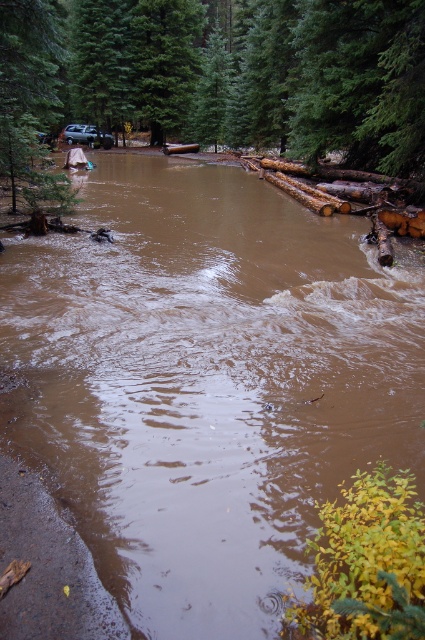
Question: Which object is the farthest from the green matte tree at upper center?

Choices:
 (A) green matte tree at upper left
 (B) metallic silver suv at upper left

Answer: (B)

Question: Is green matte tree at upper left thinner than metallic silver suv at upper left?

Choices:
 (A) no
 (B) yes

Answer: (A)

Question: Estimate the real-world distances between objects in this image. Which object is closer to the metallic silver suv at upper left?

Choices:
 (A) green matte tree at upper center
 (B) green matte tree at upper left

Answer: (A)

Question: Which object appears closest to the camera in this image?

Choices:
 (A) green matte tree at upper center
 (B) metallic silver suv at upper left

Answer: (A)

Question: From the image, what is the correct spatial relationship of green matte tree at upper center in relation to green matte tree at upper left?

Choices:
 (A) below
 (B) above

Answer: (B)

Question: Where is green matte tree at upper left located in relation to metallic silver suv at upper left in the image?

Choices:
 (A) left
 (B) right

Answer: (B)